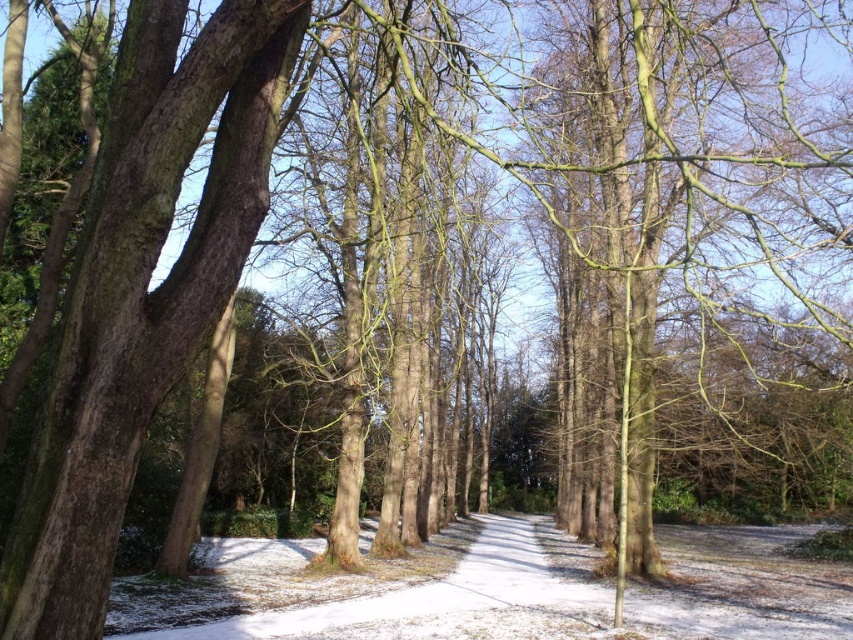
Question: Is smooth brown tree trunk at left further to camera compared to white snow-covered path at center?

Choices:
 (A) no
 (B) yes

Answer: (A)

Question: Among these points, which one is farthest from the camera?

Choices:
 (A) coord(720,596)
 (B) coord(187,70)

Answer: (A)

Question: Which object is closer to the camera taking this photo?

Choices:
 (A) smooth brown tree trunk at left
 (B) white snow-covered path at center

Answer: (A)

Question: Can you confirm if smooth brown tree trunk at left is positioned below white snow-covered path at center?

Choices:
 (A) no
 (B) yes

Answer: (A)

Question: Does smooth brown tree trunk at left lie in front of white snow-covered path at center?

Choices:
 (A) yes
 (B) no

Answer: (A)